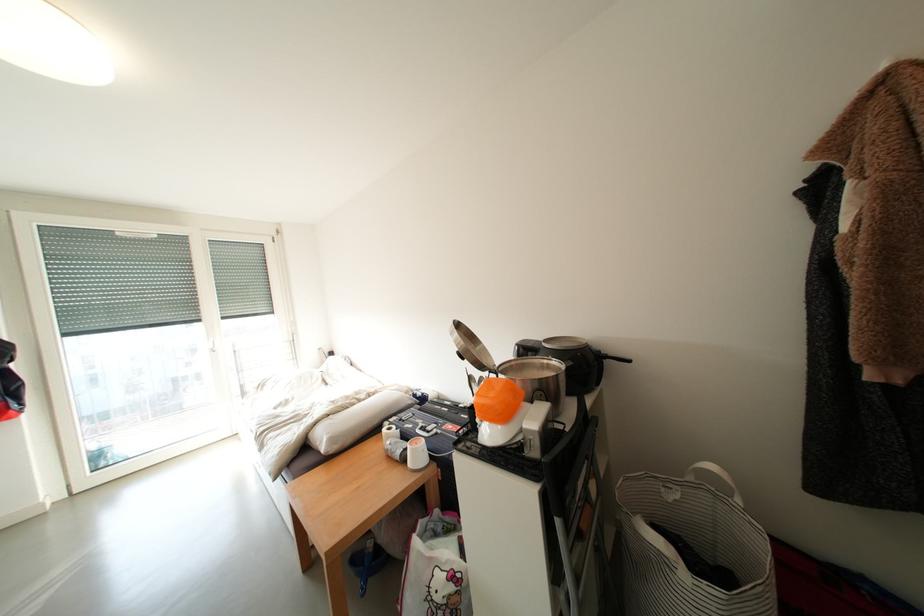
Identify the location of striped bag handle. Image resolution: width=924 pixels, height=616 pixels. (671, 545).